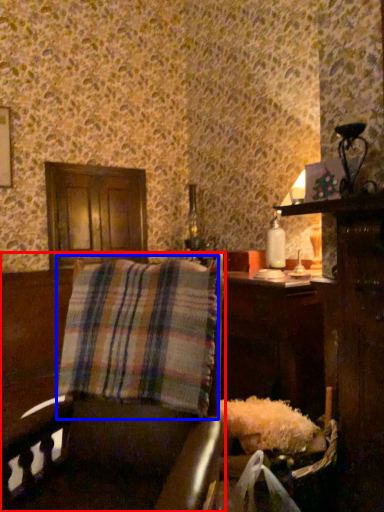
Question: Among these objects, which one is nearest to the camera, furniture (highlighted by a red box) or plaid (highlighted by a blue box)?

Choices:
 (A) furniture
 (B) plaid

Answer: (A)